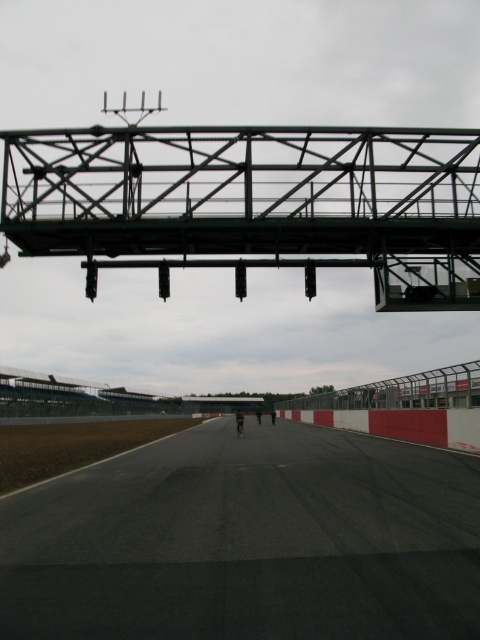
Question: Observing the image, what is the correct spatial positioning of black asphalt runway at center in reference to black fabric person at center?

Choices:
 (A) right
 (B) left

Answer: (A)

Question: Which point is farther to the camera?

Choices:
 (A) (242, 416)
 (B) (19, 225)
 (C) (316, 486)

Answer: (A)

Question: Which point is farther to the camera?

Choices:
 (A) (458, 131)
 (B) (238, 429)

Answer: (B)

Question: From the image, what is the correct spatial relationship of black asphalt runway at center in relation to green metallic overpass at upper center?

Choices:
 (A) below
 (B) above

Answer: (A)

Question: Which point is farther from the camera taking this photo?

Choices:
 (A) (239, 428)
 (B) (62, 154)
 (C) (62, 634)

Answer: (A)

Question: Is black asphalt runway at center closer to the viewer compared to green metallic overpass at upper center?

Choices:
 (A) no
 (B) yes

Answer: (B)